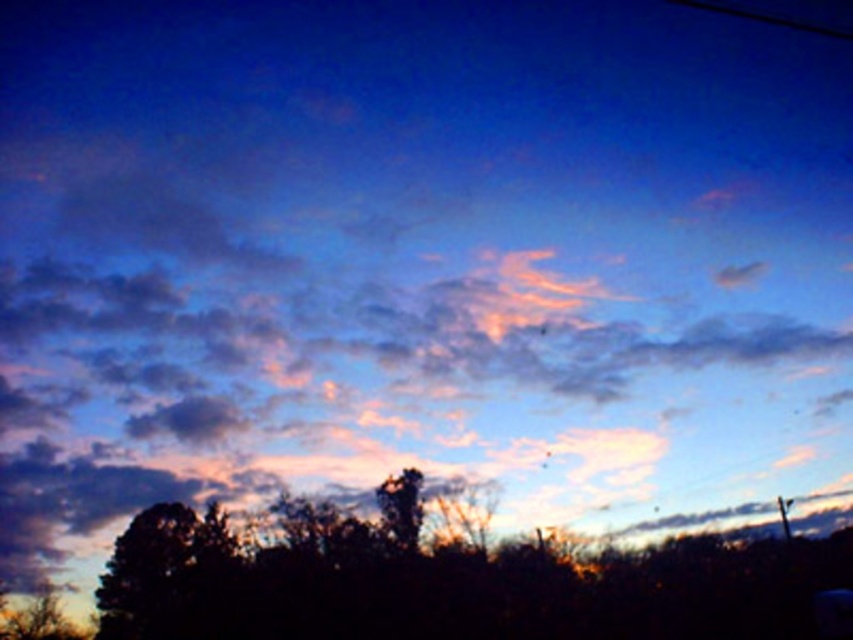
Is point (212, 552) positioned in front of point (378, 490)?

No, (212, 552) is further to viewer.

Is dark green leafy tree at lower left to the left of smooth bark tree at center from the viewer's perspective?

Yes, dark green leafy tree at lower left is to the left of smooth bark tree at center.

Does point (155, 516) come in front of point (389, 476)?

No, (155, 516) is behind (389, 476).

Image resolution: width=853 pixels, height=640 pixels. Identify the location of dark green leafy tree at lower left. (167, 573).

Who is more distant from viewer, (254,609) or (195,564)?

The point (195,564) is behind.

Which of these two, dark brown textured tree at center or dark green leafy tree at lower left, stands taller?

dark brown textured tree at center

Which is in front, point (187, 582) or point (186, 534)?

Point (187, 582) is in front.

Find the location of `dark brown textured tree at center`. dark brown textured tree at center is located at coordinates (459, 586).

Can you confirm if dark brown textured tree at center is bigger than smooth bark tree at center?

Correct, dark brown textured tree at center is larger in size than smooth bark tree at center.

Is dark brown textured tree at center taller than smooth bark tree at center?

Yes.

Which is behind, point (692, 561) or point (387, 477)?

The point (692, 561) is more distant.

Find the location of a particular element. dark brown textured tree at center is located at coordinates (459, 586).